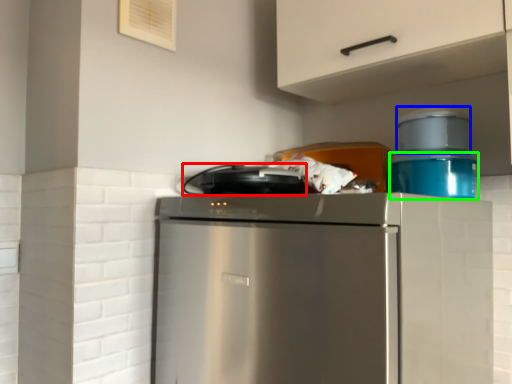
Question: Which is farther away from appliance (highlighted by a red box)? appliance (highlighted by a blue box) or appliance (highlighted by a green box)?

Choices:
 (A) appliance
 (B) appliance

Answer: (A)